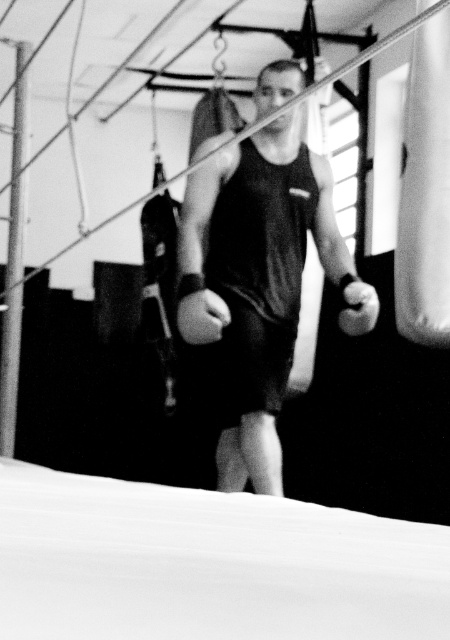
Is point (205, 317) positioned in front of point (341, 296)?

Yes, it is.

The height and width of the screenshot is (640, 450). What are the coordinates of `black matte tank top at center` in the screenshot? It's located at (255, 280).